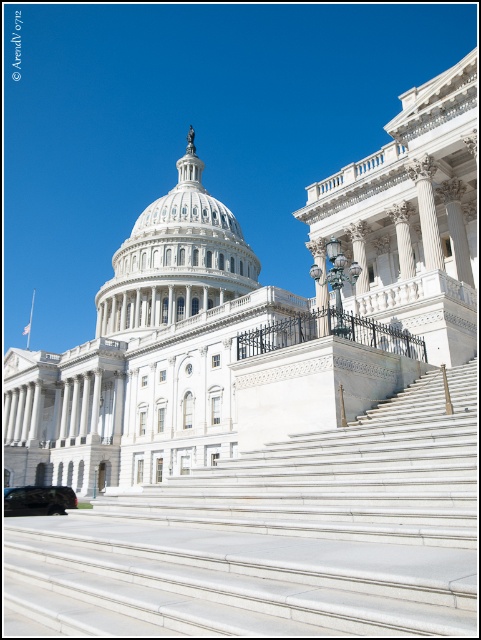
Question: Based on their relative distances, which object is farther from the shiny black car at lower left?

Choices:
 (A) black wrought iron railing at center
 (B) white marble stairs at center

Answer: (A)

Question: Is black wrought iron railing at center closer to camera compared to shiny black car at lower left?

Choices:
 (A) yes
 (B) no

Answer: (A)

Question: Which point is farther to the camera?

Choices:
 (A) (70, 500)
 (B) (128, 545)

Answer: (A)

Question: Considering the relative positions of black wrought iron railing at center and white marble column at upper center in the image provided, where is black wrought iron railing at center located with respect to white marble column at upper center?

Choices:
 (A) right
 (B) left

Answer: (B)

Question: Which object is positioned closest to the black wrought iron railing at center?

Choices:
 (A) white marble column at upper center
 (B) white marble dome at center

Answer: (A)

Question: Does white marble dome at center have a smaller size compared to shiny black car at lower left?

Choices:
 (A) no
 (B) yes

Answer: (A)